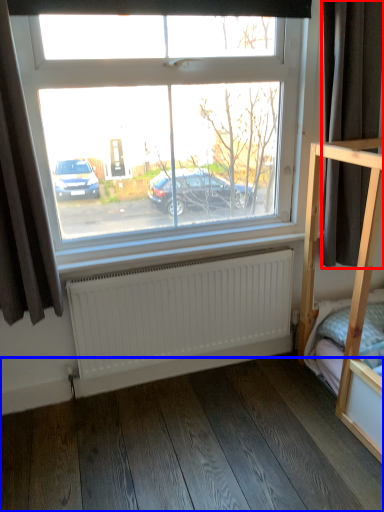
Question: Which point is further to the camera, curtain (highlighted by a red box) or hardwood (highlighted by a blue box)?

Choices:
 (A) curtain
 (B) hardwood

Answer: (A)